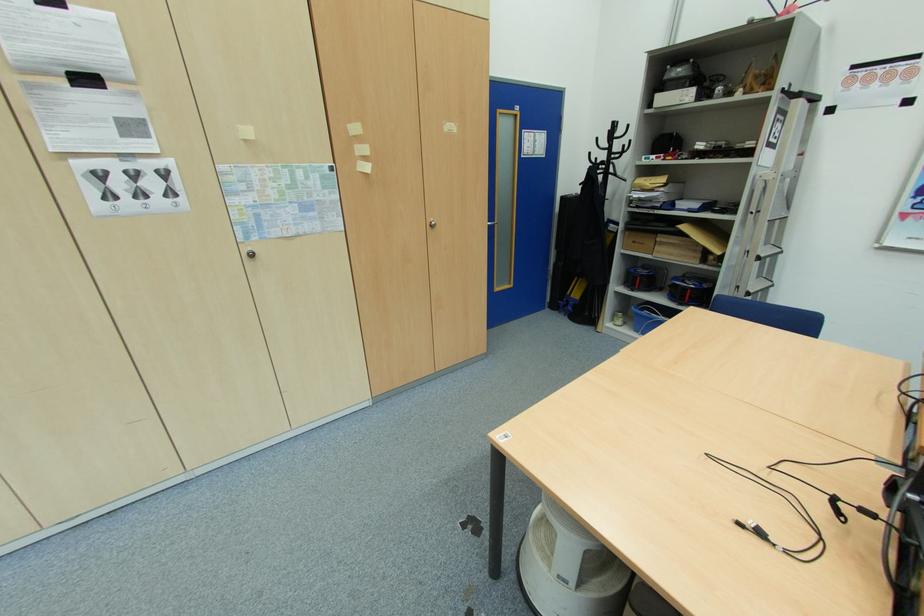
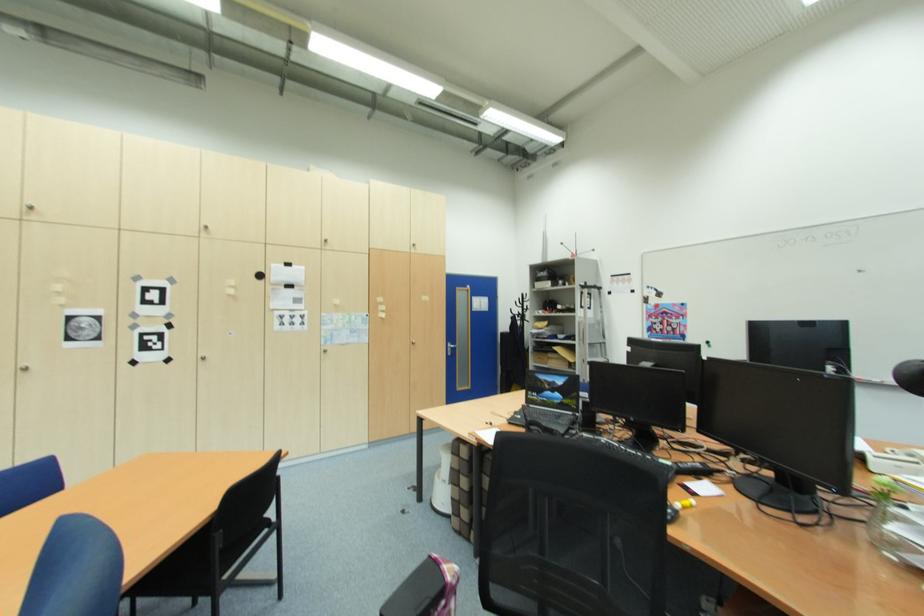
Where in the second image is the point corresponding to (x=435, y=227) from the first image?

(418, 345)